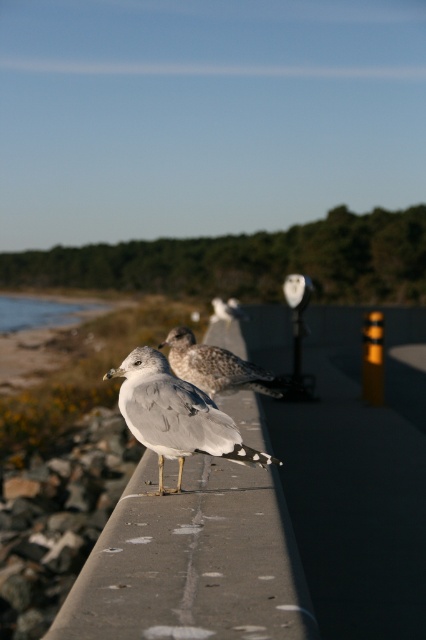
Question: Among these points, which one is nearest to the camera?

Choices:
 (A) (146, 416)
 (B) (264, 369)

Answer: (A)

Question: Can you confirm if gray feathered seagull at center is positioned above speckled feathered seagull at center?

Choices:
 (A) no
 (B) yes

Answer: (A)

Question: Among these points, which one is nearest to the camera?

Choices:
 (A) (233, 442)
 (B) (268, 387)

Answer: (A)

Question: Which point appears farthest from the camera in this image?

Choices:
 (A) (170, 428)
 (B) (218, 358)

Answer: (B)

Question: Is gray feathered seagull at center positioned behind speckled feathered seagull at center?

Choices:
 (A) yes
 (B) no

Answer: (B)

Question: Can you confirm if gray feathered seagull at center is wider than speckled feathered seagull at center?

Choices:
 (A) no
 (B) yes

Answer: (A)